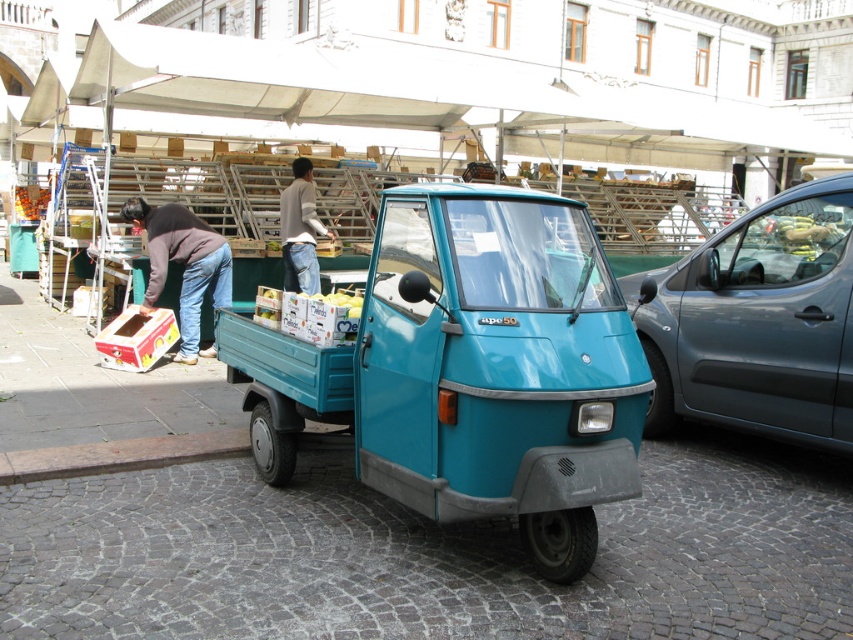
Does metallic gray car at right have a greater width compared to jeans at left?

Yes, metallic gray car at right is wider than jeans at left.

Which is in front, point (751, 353) or point (132, 220)?

Positioned in front is point (751, 353).

Where is `metallic gray car at right`? This screenshot has height=640, width=853. metallic gray car at right is located at coordinates (x=757, y=321).

Which is above, teal matte truck at center or metallic gray car at right?

metallic gray car at right

Who is positioned more to the right, teal matte truck at center or metallic gray car at right?

From the viewer's perspective, metallic gray car at right appears more on the right side.

Describe the element at coordinates (469, 369) in the screenshot. This screenshot has width=853, height=640. I see `teal matte truck at center` at that location.

Image resolution: width=853 pixels, height=640 pixels. I want to click on teal matte truck at center, so click(x=469, y=369).

Does teal matte truck at center come in front of light brown denim jeans at center?

That is True.

Does teal matte truck at center appear under light brown denim jeans at center?

Indeed, teal matte truck at center is positioned under light brown denim jeans at center.

Which is in front, point (610, 314) or point (299, 234)?

Point (610, 314) is in front.

The height and width of the screenshot is (640, 853). I want to click on teal matte truck at center, so click(469, 369).